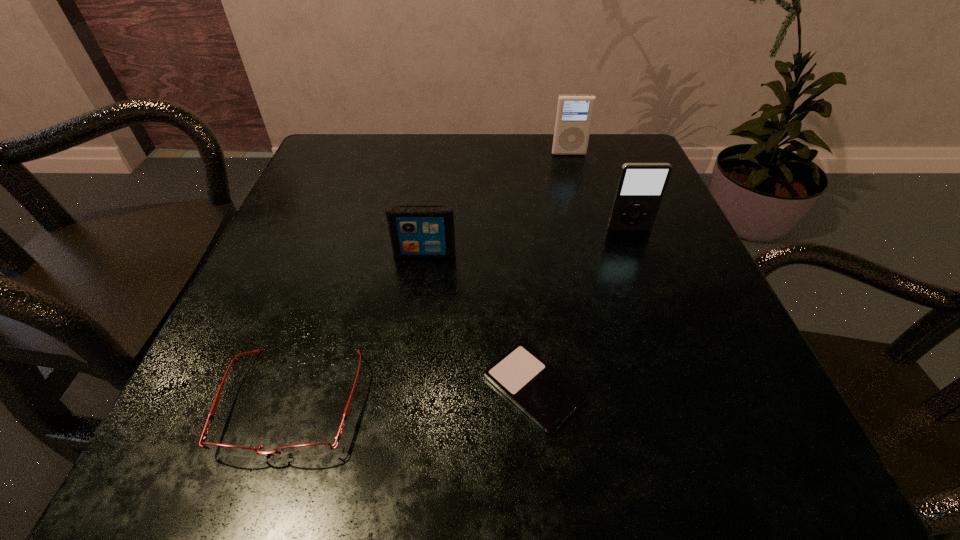
Image resolution: width=960 pixels, height=540 pixels. I want to click on blank area located on the front screen of the third farthest object, so click(401, 431).

This screenshot has height=540, width=960. I want to click on vacant space positioned on the back of the third object from right to left, so [515, 197].

The image size is (960, 540). Find the location of `object that is at the far edge`. object that is at the far edge is located at coordinates (574, 113).

This screenshot has width=960, height=540. Identify the location of spectacles at the near edge. (311, 449).

I want to click on iPod at the near edge, so click(x=544, y=395).

You are a GUI agent. You are given a task and a screenshot of the screen. Output one action in this format:
    pyautogui.click(x=<x>, y=<y>)
    Task: Click on the object positioned at the left edge
    This screenshot has height=540, width=960.
    Given the screenshot: What is the action you would take?
    pyautogui.click(x=311, y=449)

Locate an element on the screen. Image resolution: width=960 pixels, height=540 pixels. object present at the near left corner is located at coordinates (311, 449).

Where is `object that is at the far right corner`? The image size is (960, 540). object that is at the far right corner is located at coordinates (574, 113).

Identify the location of vacant space at the far edge of the desktop. (500, 184).

Locate an element on the screen. This screenshot has height=540, width=960. free space at the near edge of the desktop is located at coordinates (469, 416).